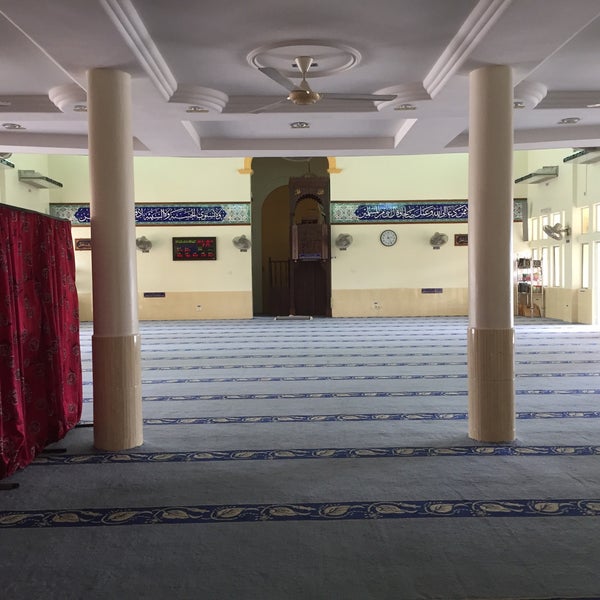
This screenshot has width=600, height=600. I want to click on vent, so click(x=309, y=118).